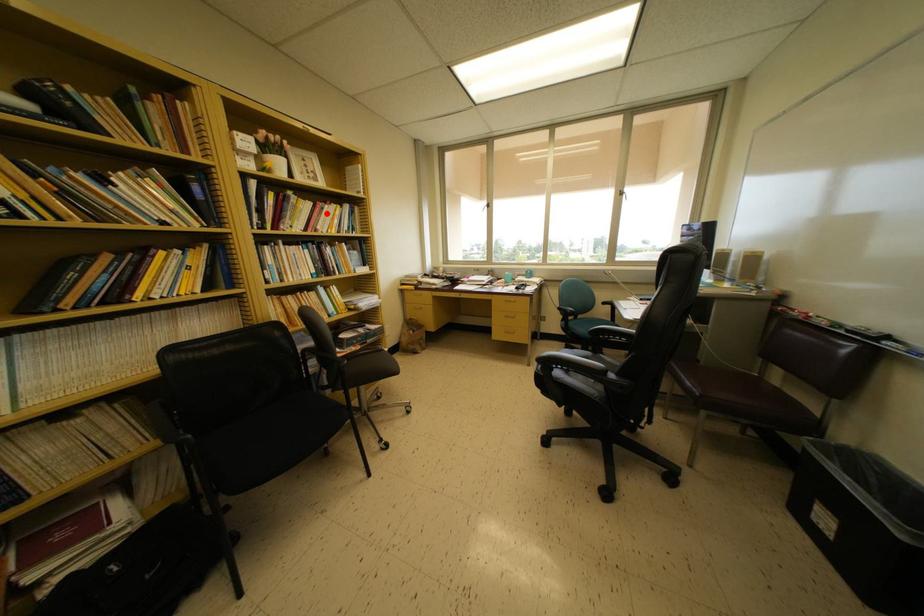
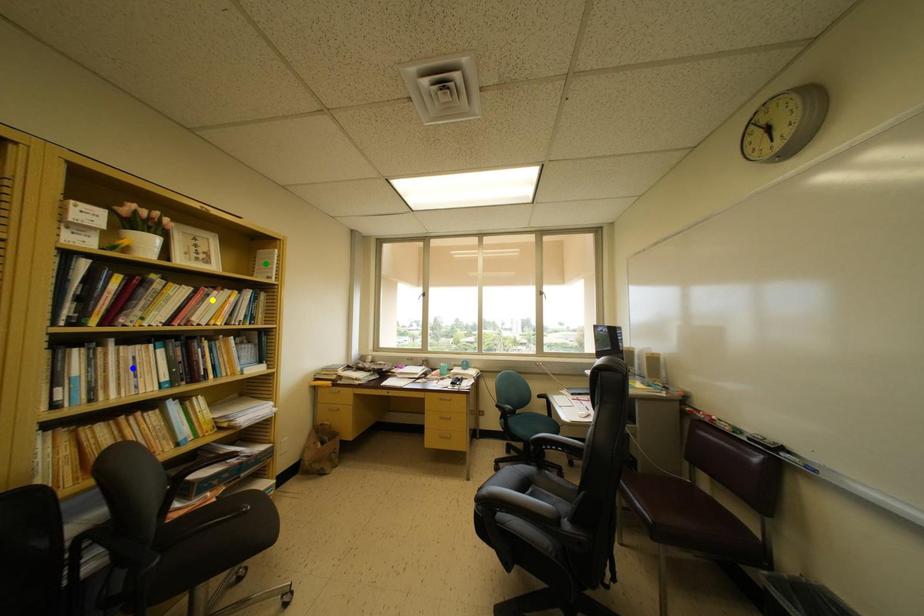
Question: I am providing you with two images of the same scene from different viewpoints. A red point is marked on the first image. You are given multiple points on the second image. In image 2, which mark is for the same physical point as the one in image 1?

Choices:
 (A) blue point
 (B) green point
 (C) yellow point

Answer: (C)